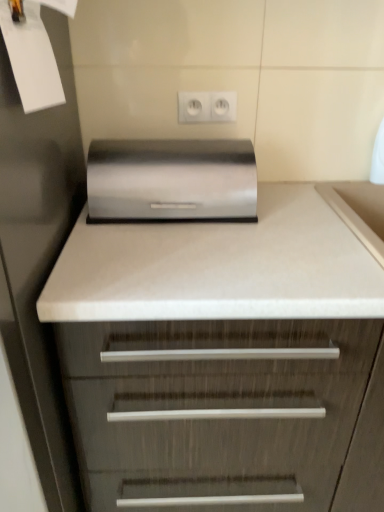
Find the location of a particular element. The width and height of the screenshot is (384, 512). satin metallic breadbox at center is located at coordinates (171, 180).

This screenshot has width=384, height=512. Identify the location of white paper at upper left. (31, 58).

The height and width of the screenshot is (512, 384). What do you see at coordinates (194, 106) in the screenshot?
I see `white plastic electric outlet at upper center` at bounding box center [194, 106].

Identify the location of satin metallic breadbox at center. The height and width of the screenshot is (512, 384). (171, 180).

Which is correct: satin wood chest of drawers at center is inside satin metallic breadbox at center, or outside of it?

satin wood chest of drawers at center is not enclosed by satin metallic breadbox at center.

From a real-world perspective, is satin wood chest of drawers at center positioned over satin metallic breadbox at center based on gravity?

No.

Is point (203, 289) less distant than point (158, 212)?

Yes, point (203, 289) is closer to viewer.

Is satin wood chest of drawers at center wider than satin metallic breadbox at center?

Yes, satin wood chest of drawers at center is wider than satin metallic breadbox at center.

Considering the relative sizes of satin wood chest of drawers at center and white paper at upper left in the image provided, is satin wood chest of drawers at center wider than white paper at upper left?

Correct, the width of satin wood chest of drawers at center exceeds that of white paper at upper left.

Which is less distant, [225,373] or [20,67]?

Clearly, point [225,373] is more distant from the camera than point [20,67].

Can you confirm if satin wood chest of drawers at center is positioned to the right of white paper at upper left?

Yes.

Considering the positions of points (110, 199) and (14, 59), is point (110, 199) farther from camera compared to point (14, 59)?

That is True.

Is satin metallic breadbox at center aimed at white paper at upper left?

No, satin metallic breadbox at center does not turn towards white paper at upper left.

Which of these two, satin metallic breadbox at center or white paper at upper left, is wider?

With larger width is satin metallic breadbox at center.

From the image's perspective, is satin metallic breadbox at center above or below white paper at upper left?

Clearly, from the image's perspective, satin metallic breadbox at center is below white paper at upper left.

Which of these two, white paper at upper left or satin wood chest of drawers at center, is wider?

Wider between the two is satin wood chest of drawers at center.

Is white paper at upper left oriented away from satin wood chest of drawers at center?

That's not correct — white paper at upper left is not looking away from satin wood chest of drawers at center.

Who is more distant, white paper at upper left or satin wood chest of drawers at center?

satin wood chest of drawers at center is more distant.

In the scene shown: From the image's perspective, who appears lower, white paper at upper left or satin wood chest of drawers at center?

satin wood chest of drawers at center, from the image's perspective.

Considering the sizes of objects white plastic electric outlet at upper center and satin metallic breadbox at center in the image provided, who is thinner, white plastic electric outlet at upper center or satin metallic breadbox at center?

white plastic electric outlet at upper center.

What's the angular difference between white plastic electric outlet at upper center and satin metallic breadbox at center's facing directions?

The angle between the facing direction of white plastic electric outlet at upper center and the facing direction of satin metallic breadbox at center is 0.00403 degrees.

From the image's perspective, does white plastic electric outlet at upper center appear lower than satin metallic breadbox at center?

No.

Which is behind, point (179, 96) or point (164, 166)?

The point (179, 96) is farther.

Considering the relative sizes of white plastic electric outlet at upper center and white paper at upper left in the image provided, is white plastic electric outlet at upper center smaller than white paper at upper left?

Correct, white plastic electric outlet at upper center occupies less space than white paper at upper left.

This screenshot has width=384, height=512. What are the coordinates of `paper that is below the white plastic electric outlet at upper center (from the image's perspective)` in the screenshot? It's located at (31, 58).

Which is more to the right, white plastic electric outlet at upper center or satin wood chest of drawers at center?

From the viewer's perspective, satin wood chest of drawers at center appears more on the right side.

Is white plastic electric outlet at upper center looking in the opposite direction of satin wood chest of drawers at center?

white plastic electric outlet at upper center does not have its back to satin wood chest of drawers at center.

In terms of width, does white plastic electric outlet at upper center look wider or thinner when compared to satin wood chest of drawers at center?

white plastic electric outlet at upper center is thinner than satin wood chest of drawers at center.

Locate an element on the screen. This screenshot has height=512, width=384. home appliance behind the satin wood chest of drawers at center is located at coordinates (171, 180).

The width and height of the screenshot is (384, 512). In order to click on paper above the satin wood chest of drawers at center (from the image's perspective) in this screenshot , I will do `click(31, 58)`.

From the picture: Which object lies further to the anchor point white paper at upper left, white plastic electric outlet at upper center or satin wood chest of drawers at center?

satin wood chest of drawers at center lies further to white paper at upper left than the other object.

From the image, which object appears to be nearer to white plastic electric outlet at upper center, satin wood chest of drawers at center or satin metallic breadbox at center?

satin metallic breadbox at center is closer to white plastic electric outlet at upper center.

Which object lies nearer to the anchor point satin metallic breadbox at center, white paper at upper left or white plastic electric outlet at upper center?

Among the two, white plastic electric outlet at upper center is located nearer to satin metallic breadbox at center.

Looking at the image, which one is located further to satin metallic breadbox at center, white plastic electric outlet at upper center or satin wood chest of drawers at center?

Based on the image, satin wood chest of drawers at center appears to be further to satin metallic breadbox at center.

Which object lies nearer to the anchor point white paper at upper left, satin wood chest of drawers at center or satin metallic breadbox at center?

satin metallic breadbox at center.

Estimate the real-world distances between objects in this image. Which object is closer to satin wood chest of drawers at center, white paper at upper left or white plastic electric outlet at upper center?

white paper at upper left is closer to satin wood chest of drawers at center.

Based on their spatial positions, is satin metallic breadbox at center or white paper at upper left further from satin wood chest of drawers at center?

white paper at upper left is further to satin wood chest of drawers at center.

From the picture: Looking at the image, which one is located further to satin wood chest of drawers at center, white paper at upper left or satin metallic breadbox at center?

The object further to satin wood chest of drawers at center is white paper at upper left.

Where is `paper between white plastic electric outlet at upper center and satin wood chest of drawers at center from top to bottom`? paper between white plastic electric outlet at upper center and satin wood chest of drawers at center from top to bottom is located at coordinates tap(31, 58).

You are a GUI agent. You are given a task and a screenshot of the screen. Output one action in this format:
    pyautogui.click(x=<x>, y=<y>)
    Task: Click on the home appliance that lies between white plastic electric outlet at upper center and satin wood chest of drawers at center from top to bottom
    This screenshot has height=512, width=384.
    Given the screenshot: What is the action you would take?
    (x=171, y=180)

At what (x,y) coordinates should I click in order to perform the action: click on home appliance that lies between white paper at upper left and satin wood chest of drawers at center from top to bottom. Please return your answer as a coordinate pair (x, y). This screenshot has width=384, height=512. Looking at the image, I should click on (171, 180).

Locate an element on the screen. home appliance between white paper at upper left and white plastic electric outlet at upper center along the z-axis is located at coordinates (171, 180).